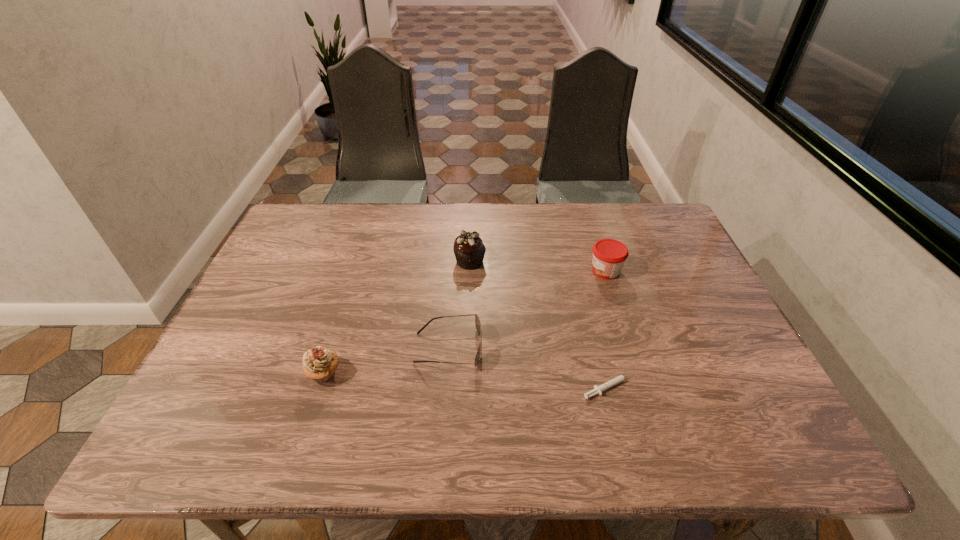
Find the location of a particular element. the farther cupcake is located at coordinates (469, 250).

Locate an element on the screen. This screenshot has height=540, width=960. the left cupcake is located at coordinates (319, 364).

This screenshot has height=540, width=960. Identify the location of the leftmost object. (319, 364).

I want to click on jam, so click(x=609, y=255).

The width and height of the screenshot is (960, 540). Find the location of `sunglasses`. sunglasses is located at coordinates (477, 322).

I want to click on the shortest object, so click(x=597, y=389).

Identify the location of vacant space situated 0.080m on the back of the farther cupcake. (470, 235).

Identify the location of free location located 0.160m on the right of the nearer cupcake. (412, 373).

Where is `vacant region located on the label side of the third shortest object`? The width and height of the screenshot is (960, 540). vacant region located on the label side of the third shortest object is located at coordinates (469, 270).

I want to click on vacant region located on the label side of the third shortest object, so click(526, 270).